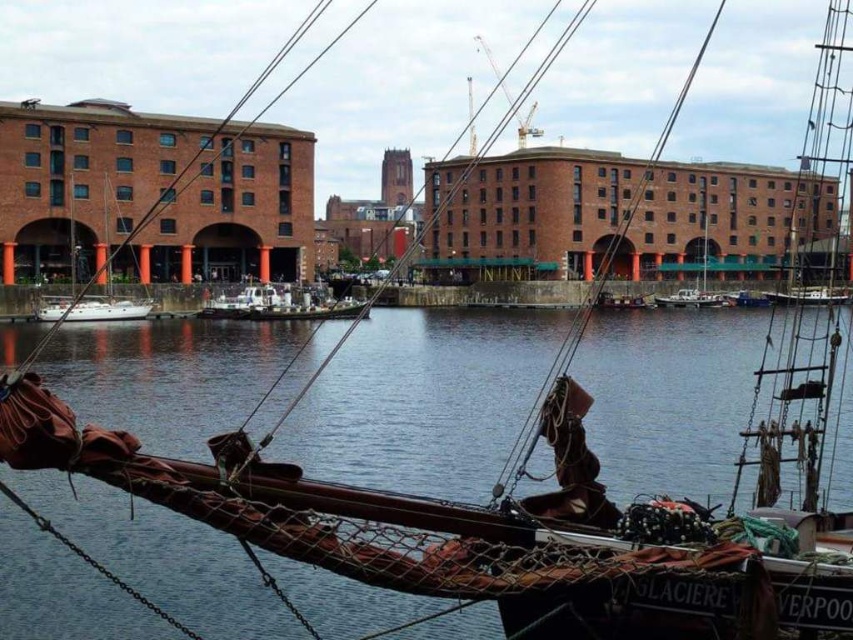
Question: Is white matte sailboat at left smaller than white matte sailboat at lower left?

Choices:
 (A) no
 (B) yes

Answer: (A)

Question: Considering the relative positions of transparent water at center and white matte sailboat at left in the image provided, where is transparent water at center located with respect to white matte sailboat at left?

Choices:
 (A) left
 (B) right

Answer: (B)

Question: Which point is farther to the camera?

Choices:
 (A) white plastic boat at center
 (B) white matte sailboat at lower left
 (C) white matte sailboat at left
 (D) transparent water at center

Answer: (A)

Question: Among these objects, which one is farthest from the camera?

Choices:
 (A) transparent water at center
 (B) white matte sailboat at lower left
 (C) white plastic boat at center
 (D) white matte sailboat at left

Answer: (C)

Question: Is transparent water at center to the left of white plastic boat at center from the viewer's perspective?

Choices:
 (A) no
 (B) yes

Answer: (B)

Question: Which object appears farthest from the camera in this image?

Choices:
 (A) white matte sailboat at left
 (B) white plastic boat at center
 (C) white matte sailboat at lower left
 (D) transparent water at center

Answer: (B)